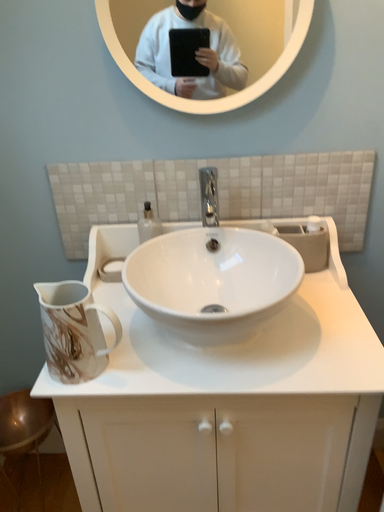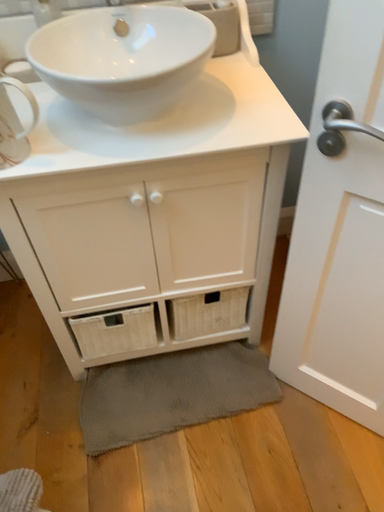
Question: Which way did the camera rotate in the video?

Choices:
 (A) rotated left
 (B) rotated right

Answer: (B)